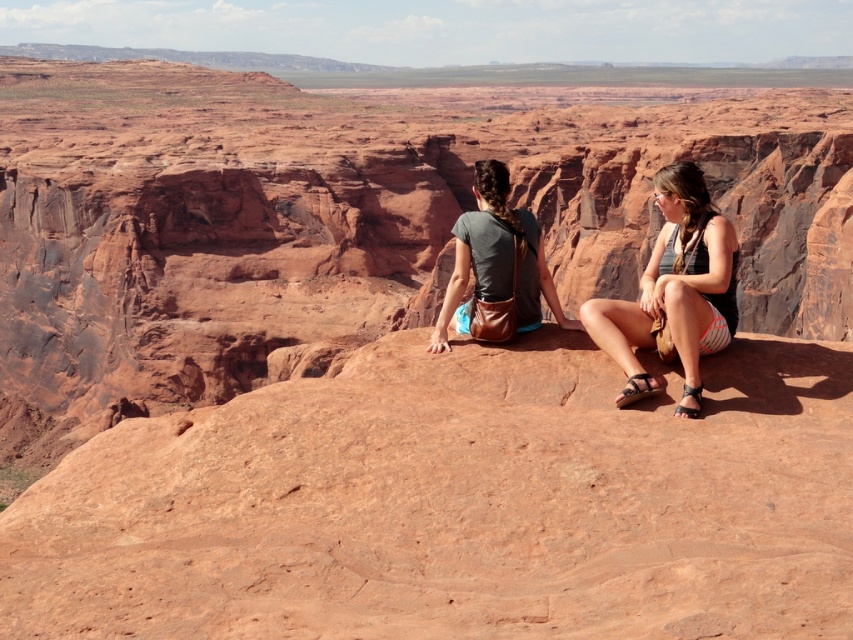
Question: Which point is farther from the camera taking this photo?

Choices:
 (A) coord(469,256)
 (B) coord(694,211)

Answer: (A)

Question: Considering the relative positions of striped shorts at center and matte brown purse at center in the image provided, where is striped shorts at center located with respect to matte brown purse at center?

Choices:
 (A) above
 (B) below

Answer: (B)

Question: Among these points, which one is nearest to the camera?

Choices:
 (A) (555, 300)
 (B) (625, 310)

Answer: (B)

Question: Which point is closer to the camera?

Choices:
 (A) striped shorts at center
 (B) matte brown purse at center

Answer: (A)

Question: Does striped shorts at center have a lesser width compared to matte brown purse at center?

Choices:
 (A) no
 (B) yes

Answer: (A)

Question: Can you confirm if striped shorts at center is positioned to the right of matte brown purse at center?

Choices:
 (A) yes
 (B) no

Answer: (A)